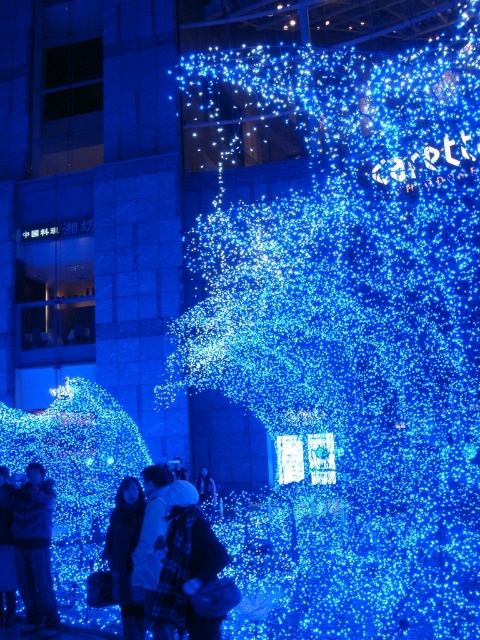
Question: Can you confirm if matte black jacket at lower left is positioned to the left of white matte jacket at center?

Choices:
 (A) yes
 (B) no

Answer: (A)

Question: Observing the image, what is the correct spatial positioning of dark blue fabric coat at center in reference to white woolen hat at lower left?

Choices:
 (A) right
 (B) left

Answer: (A)

Question: Which object is farther from the camera taking this photo?

Choices:
 (A) matte black jacket at lower left
 (B) white woolen hat at lower left

Answer: (B)

Question: Among these points, which one is nearest to the camera?

Choices:
 (A) (1, 568)
 (B) (197, 484)
 (C) (121, 481)
 (D) (34, 586)

Answer: (D)

Question: Is matte black jacket at lower left positioned at the back of white woolen hat at lower left?

Choices:
 (A) yes
 (B) no

Answer: (B)

Question: Which point appears farthest from the camera in this image?

Choices:
 (A) (204, 493)
 (B) (50, 627)
 (C) (7, 596)
 (D) (129, 596)

Answer: (A)